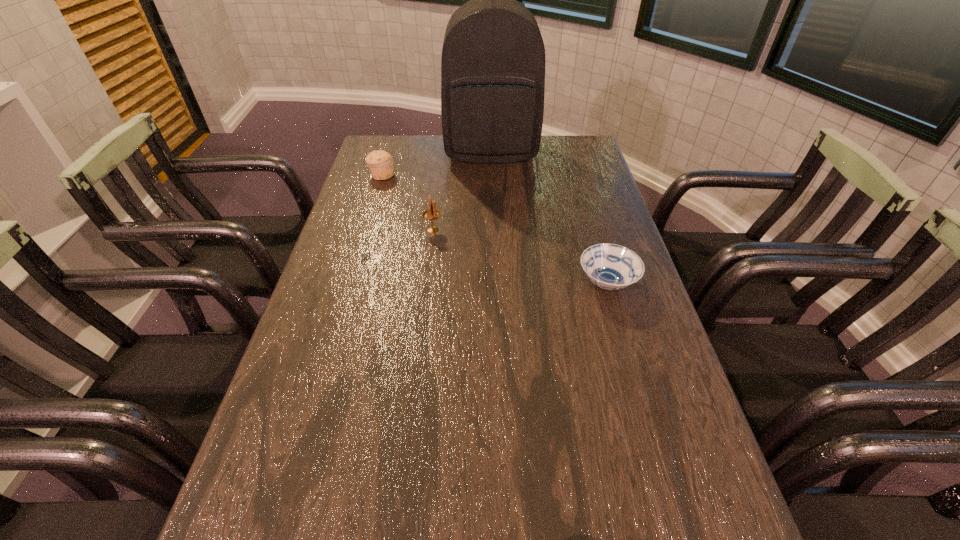
This screenshot has height=540, width=960. Find the location of `free spot between the third farthest object and the soup bowl`. free spot between the third farthest object and the soup bowl is located at coordinates click(520, 256).

Locate an element on the screen. free space between the muffin and the third farthest object is located at coordinates (407, 202).

Image resolution: width=960 pixels, height=540 pixels. I want to click on vacant area that lies between the soup bowl and the backpack, so click(549, 218).

I want to click on free area in between the backpack and the leftmost object, so click(437, 163).

Where is `the third closest object relative to the shortest object`? the third closest object relative to the shortest object is located at coordinates (380, 162).

Locate an element on the screen. Image resolution: width=960 pixels, height=540 pixels. object that is the closest to the backpack is located at coordinates (380, 162).

Find the location of a particular element. The width and height of the screenshot is (960, 540). free point that satisfies the following two spatial constraints: 1. on the front side of the third shortest object; 2. on the left side of the rightmost object is located at coordinates (426, 284).

Where is `free space in the image that satisfies the following two spatial constraints: 1. on the front-facing side of the soup bowl; 2. on the left side of the backpack`? The image size is (960, 540). free space in the image that satisfies the following two spatial constraints: 1. on the front-facing side of the soup bowl; 2. on the left side of the backpack is located at coordinates (495, 284).

You are a GUI agent. You are given a task and a screenshot of the screen. Output one action in this format:
    pyautogui.click(x=<x>, y=<y>)
    Task: Click on the free region that satisfies the following two spatial constraints: 1. on the front-facing side of the tallest object; 2. on the left side of the rightmost object
    
    Given the screenshot: What is the action you would take?
    pyautogui.click(x=495, y=284)